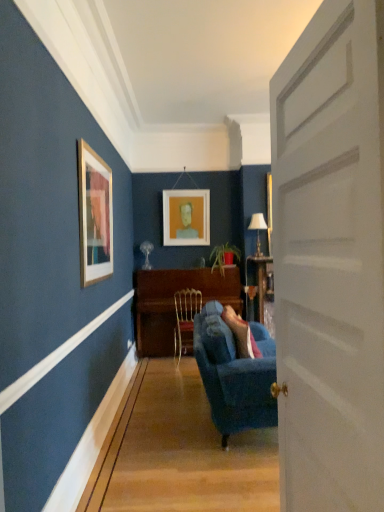
What is the approximate width of white fabric lampshade at center-right?

10.13 inches.

What is the approximate height of white matte door at center?

1.89 meters.

What do you see at coordinates (234, 375) in the screenshot?
I see `velvet blue couch at center` at bounding box center [234, 375].

Describe the element at coordinates (185, 319) in the screenshot. The width and height of the screenshot is (384, 512). I see `metallic gold chair at center` at that location.

Identify the location of velvet blue couch at center. (241, 334).

Is velvet blue couch at center inside the boundaries of wooden piano at center, or outside?

velvet blue couch at center lies outside wooden piano at center.

Is velvet blue couch at center shorter than wooden piano at center?

Indeed, velvet blue couch at center has a lesser height compared to wooden piano at center.

Is velvet blue couch at center oriented towards wooden piano at center?

No, velvet blue couch at center is not facing towards wooden piano at center.

Visually, is white fabric lampshade at center-right positioned to the left or to the right of white matte picture frame at center?

white fabric lampshade at center-right is positioned on white matte picture frame at center's right side.

How far apart are white fabric lampshade at center-right and white matte picture frame at center?

The distance of white fabric lampshade at center-right from white matte picture frame at center is 36.48 inches.

From a real-world perspective, is white fabric lampshade at center-right below white matte picture frame at center?

Yes.

Where is `picture frame on the left of white fabric lampshade at center-right`? This screenshot has height=512, width=384. picture frame on the left of white fabric lampshade at center-right is located at coordinates (186, 217).

Is point (259, 351) closer to camera compared to point (252, 217)?

Yes.

Looking at their sizes, would you say velvet blue couch at center is wider or thinner than white fabric lampshade at center-right?

In the image, velvet blue couch at center appears to be wider than white fabric lampshade at center-right.

From a real-world perspective, is velvet blue couch at center above or below white fabric lampshade at center-right?

In terms of real-world spatial position, velvet blue couch at center is below white fabric lampshade at center-right.

This screenshot has width=384, height=512. In the image, there is a white fabric lampshade at center-right. Identify the location of person below it (from a real-world perspective). (241, 334).

Considering the sizes of white matte picture frame at center and wooden piano at center in the image, is white matte picture frame at center wider or thinner than wooden piano at center?

Clearly, white matte picture frame at center has less width compared to wooden piano at center.

Considering the sizes of white matte picture frame at center and wooden piano at center in the image, is white matte picture frame at center bigger or smaller than wooden piano at center?

Considering their sizes, white matte picture frame at center takes up less space than wooden piano at center.

Does point (168, 244) come behind point (147, 276)?

That is True.

Considering the positions of point (260, 256) and point (148, 298), is point (260, 256) closer or farther from the camera than point (148, 298)?

Clearly, point (260, 256) is more distant from the camera than point (148, 298).

Locate an element on the screen. This screenshot has width=384, height=512. table beneath the white fabric lampshade at center-right (from a real-world perspective) is located at coordinates (174, 304).

Is white fabric lampshade at center-right positioned beyond the bounds of wooden piano at center?

Yes, white fabric lampshade at center-right is located beyond the bounds of wooden piano at center.

Which is more to the right, white fabric lampshade at center-right or velvet blue couch at center?

From the viewer's perspective, white fabric lampshade at center-right appears more on the right side.

Find the location of `lamp above the velvet blue couch at center (from the image's perspective)`. lamp above the velvet blue couch at center (from the image's perspective) is located at coordinates (258, 230).

Is white fabric lampshade at center-right wider than velvet blue couch at center?

Incorrect, the width of white fabric lampshade at center-right does not surpass that of velvet blue couch at center.

How many degrees apart are the facing directions of white fabric lampshade at center-right and velvet blue couch at center?

The angle between the facing direction of white fabric lampshade at center-right and the facing direction of velvet blue couch at center is 89.8 degrees.

This screenshot has width=384, height=512. In order to click on studio couch located below the white fabric lampshade at center-right (from the image's perspective) in this screenshot , I will do `click(234, 375)`.

From the image's perspective, is velvet blue couch at center located beneath white fabric lampshade at center-right?

Correct, velvet blue couch at center appears lower than white fabric lampshade at center-right in the image.

From a real-world perspective, which is physically below, velvet blue couch at center or white fabric lampshade at center-right?

In real-world perspective, velvet blue couch at center is lower.

Which of these two, velvet blue couch at center or white fabric lampshade at center-right, is smaller?

white fabric lampshade at center-right.

You are a GUI agent. You are given a task and a screenshot of the screen. Output one action in this format:
    pyautogui.click(x=<x>, y=<y>)
    Task: Click on the person on the right of wooden piano at center
    
    Given the screenshot: What is the action you would take?
    pyautogui.click(x=241, y=334)

Locate an element on the screen. picture frame located above the white fabric lampshade at center-right (from the image's perspective) is located at coordinates (186, 217).

Looking at the image, which one is located further to velvet blue couch at center, metallic gold chair at center or white matte door at center?

metallic gold chair at center lies further to velvet blue couch at center than the other object.

Which object lies further to the anchor point white matte door at center, velvet blue couch at center or white matte picture frame at center?

white matte picture frame at center is positioned further to the anchor white matte door at center.

Looking at this image, from the image, which object appears to be nearer to white fabric lampshade at center-right, wooden piano at center or velvet blue couch at center?

Among the two, wooden piano at center is located nearer to white fabric lampshade at center-right.

Considering their positions, is velvet blue couch at center positioned further to white matte picture frame at center than white matte door at center?

white matte door at center.

Looking at the image, which one is located closer to white fabric lampshade at center-right, velvet blue couch at center or white matte picture frame at center?

white matte picture frame at center is positioned closer to the anchor white fabric lampshade at center-right.

Based on their spatial positions, is white fabric lampshade at center-right or white matte picture frame at center further from velvet blue couch at center?

white fabric lampshade at center-right is positioned further to the anchor velvet blue couch at center.

Which object lies nearer to the anchor point metallic gold chair at center, white fabric lampshade at center-right or white matte picture frame at center?

white matte picture frame at center is closer to metallic gold chair at center.

From the image, which object appears to be nearer to wooden piano at center, white fabric lampshade at center-right or velvet blue couch at center?

white fabric lampshade at center-right.

You are a GUI agent. You are given a task and a screenshot of the screen. Output one action in this format:
    pyautogui.click(x=<x>, y=<y>)
    Task: Click on the lamp between white matte picture frame at center and metallic gold chair at center in the up-down direction
    The width and height of the screenshot is (384, 512).
    Given the screenshot: What is the action you would take?
    pyautogui.click(x=258, y=230)

What are the coordinates of `chair located between velvet blue couch at center and wooden piano at center in the depth direction` in the screenshot? It's located at (185, 319).

Find the location of a particular element. This screenshot has width=384, height=512. table located between velvet blue couch at center and white matte picture frame at center in the depth direction is located at coordinates (174, 304).

The width and height of the screenshot is (384, 512). Identify the location of person between velvet blue couch at center and metallic gold chair at center along the z-axis. (241, 334).